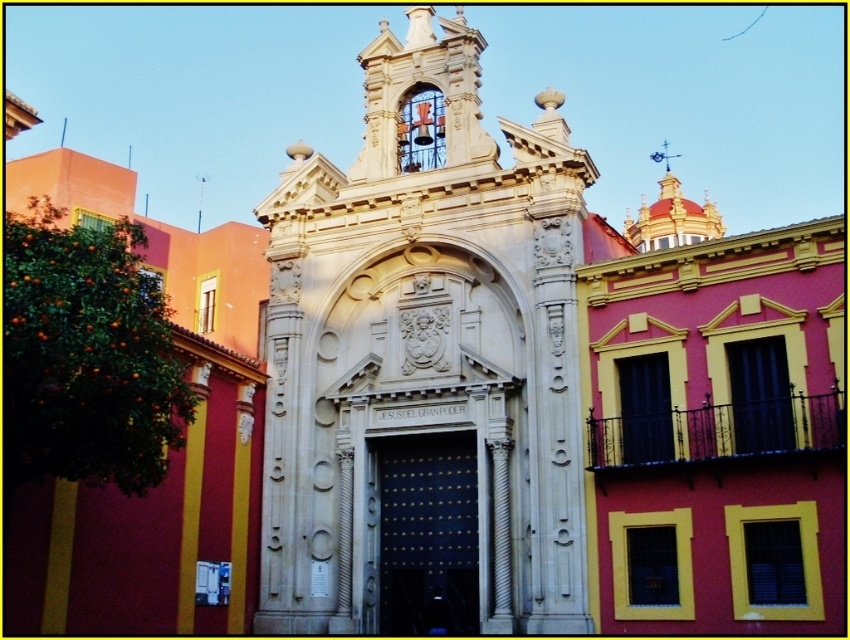
Question: Which point appears closest to the camera in this image?

Choices:
 (A) (503, 292)
 (B) (38, 371)

Answer: (B)

Question: Which point is closer to the camera taking this photo?

Choices:
 (A) (x=428, y=584)
 (B) (x=180, y=440)

Answer: (B)

Question: Does white stone chapel at center have a lesser width compared to green leafy tree at left?

Choices:
 (A) no
 (B) yes

Answer: (A)

Question: Does white stone chapel at center have a larger size compared to green leafy tree at left?

Choices:
 (A) no
 (B) yes

Answer: (B)

Question: Is white stone chapel at center closer to the viewer compared to green leafy tree at left?

Choices:
 (A) no
 (B) yes

Answer: (A)